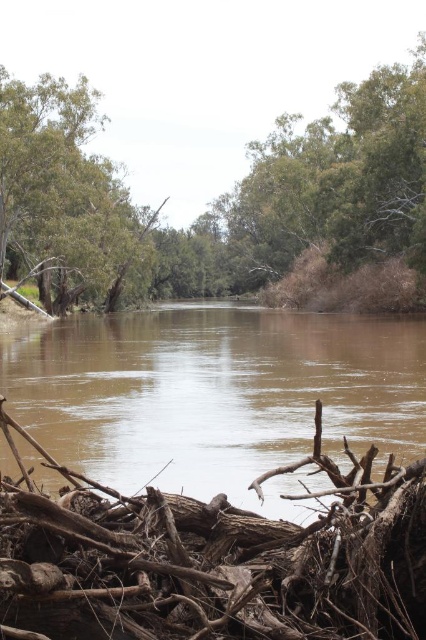
Question: Which point appears closest to the camera in this image?

Choices:
 (A) (238, 436)
 (B) (350, 241)

Answer: (A)

Question: Can you confirm if brown muddy water at center is wider than green leafy tree at upper left?

Choices:
 (A) yes
 (B) no

Answer: (A)

Question: Where is brown muddy water at center located in relation to brown rough wood at lower center in the image?

Choices:
 (A) right
 (B) left

Answer: (A)

Question: Which of the following is the farthest from the observer?

Choices:
 (A) (152, 428)
 (B) (66, 246)

Answer: (B)

Question: Does brown muddy water at center have a greater width compared to green leafy tree at upper left?

Choices:
 (A) yes
 (B) no

Answer: (A)

Question: Among these points, which one is nearest to the camera?

Choices:
 (A) (285, 202)
 (B) (389, 525)

Answer: (B)